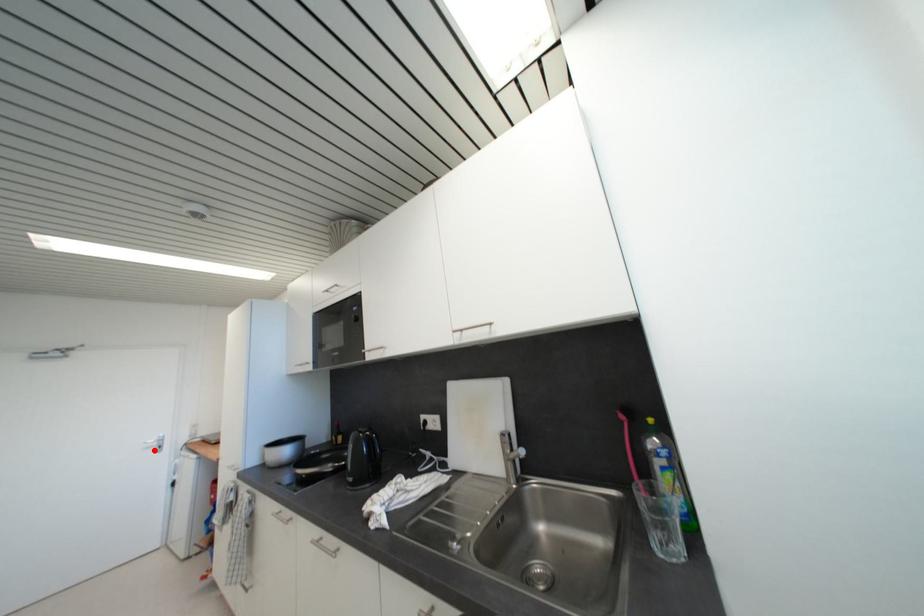
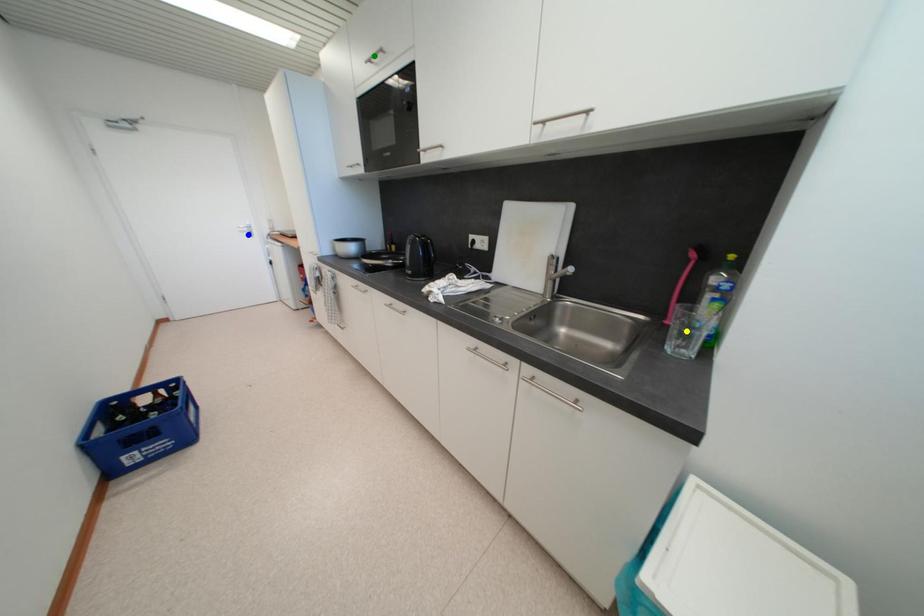
Question: I am providing you with two images of the same scene from different viewpoints. A red point is marked on the first image. You are given multiple points on the second image. Which point in image 2 represents the same 3d spot as the red point in image 1?

Choices:
 (A) yellow point
 (B) blue point
 (C) green point

Answer: (B)